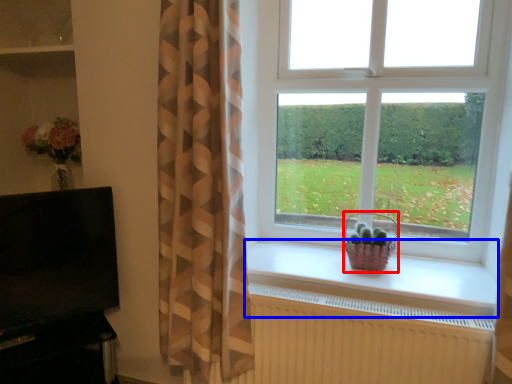
Question: Which object is further to the camera taking this photo, basket (highlighted by a red box) or window sill (highlighted by a blue box)?

Choices:
 (A) basket
 (B) window sill

Answer: (A)